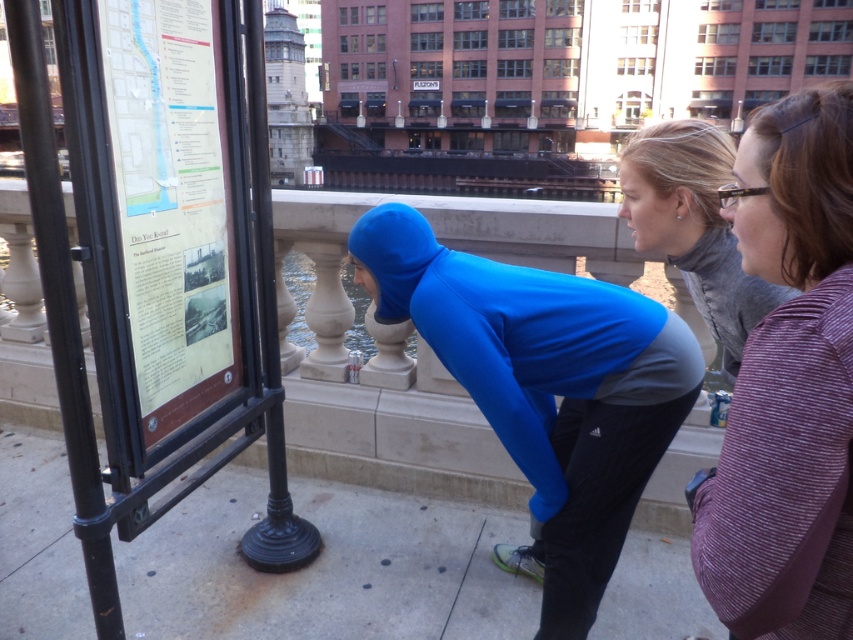
You are navigating an urban area and need to reach a destination marked on a map. You see a blue spandex squat at center. Based on its position, can you determine if it is positioned to the left or right of the center point of the map?

The blue spandex squat at center is located at point coordinates that are slightly to the right and below the exact center of the map. Since the x coordinate is 0.606 and y is 0.640, it is positioned to the right of the center point.

You are standing on the smooth concrete pavement at center. Where exactly are you located in the image?

You are located at point coordinates of (325, 568) on the smooth concrete pavement at center.